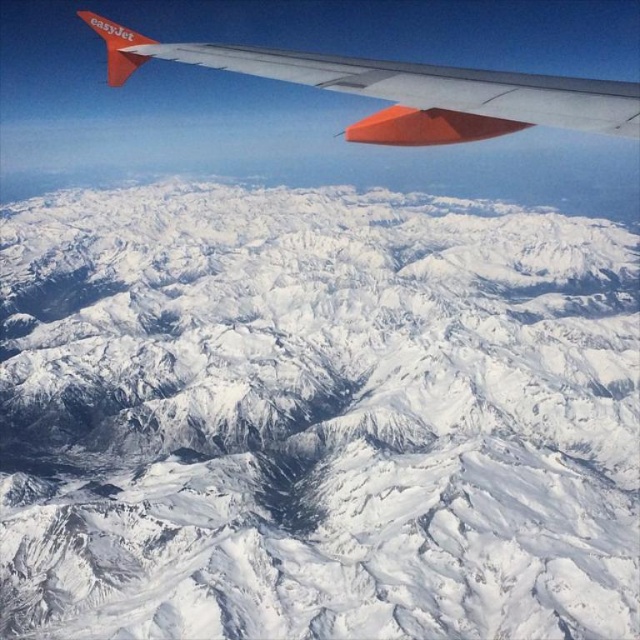
Does snowy rocky mountain range at center appear over matte orange wing at upper left?

No.

Is snowy rocky mountain range at center to the left of matte orange wing at upper left from the viewer's perspective?

No, snowy rocky mountain range at center is not to the left of matte orange wing at upper left.

Is point (464, 266) closer to camera compared to point (380, 74)?

No, it is behind (380, 74).

Find the location of a particular element. The height and width of the screenshot is (640, 640). snowy rocky mountain range at center is located at coordinates 314,417.